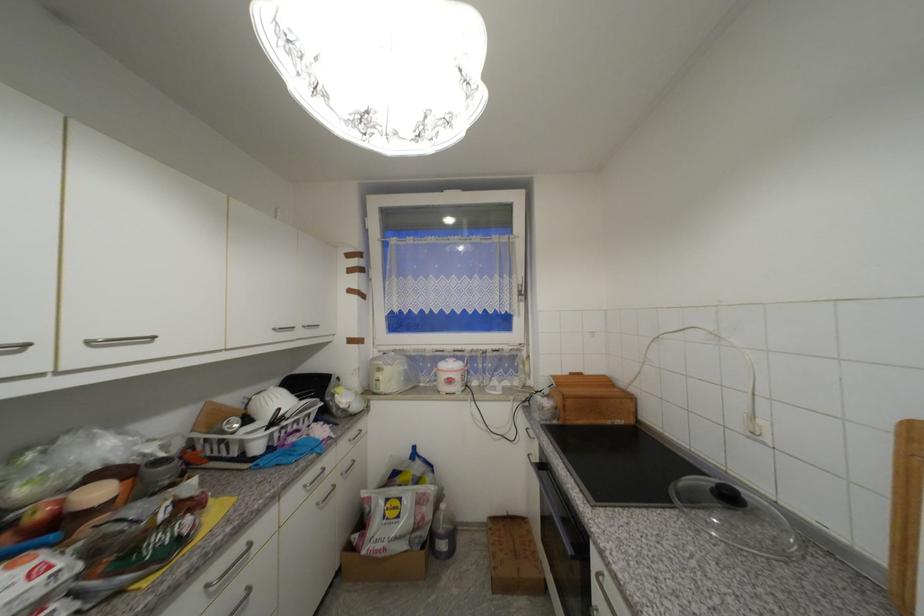
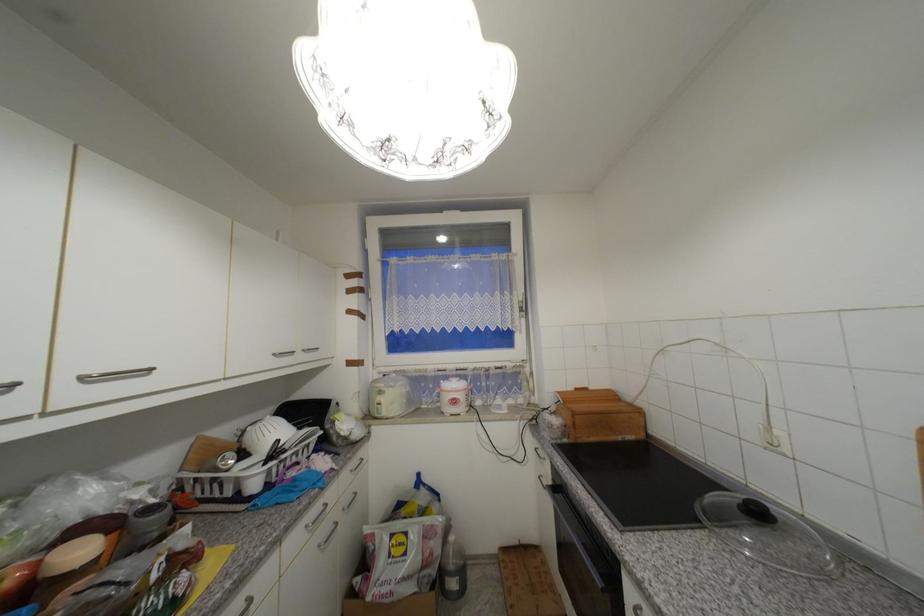
The point at (456, 382) is marked in the first image. Where is the corresponding point in the second image?

(459, 403)